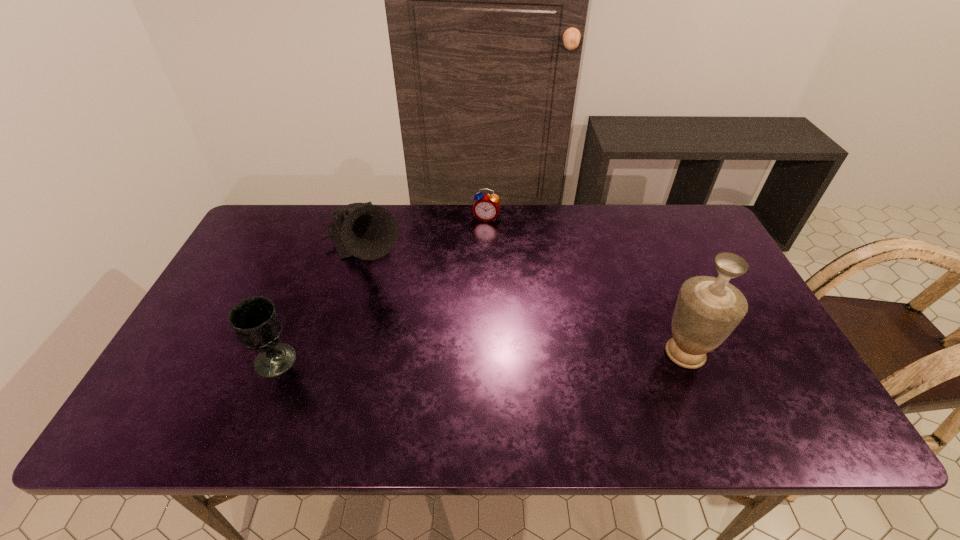
Where is `vacant space on the desktop that is between the chalice and the urn and is positioned on the front-facing side of the shortest object`? Image resolution: width=960 pixels, height=540 pixels. vacant space on the desktop that is between the chalice and the urn and is positioned on the front-facing side of the shortest object is located at coordinates (444, 357).

Find the location of `free space on the desktop that is between the chalice and the urn and is positioned from the horn of the phonograph_record`. free space on the desktop that is between the chalice and the urn and is positioned from the horn of the phonograph_record is located at coordinates (420, 358).